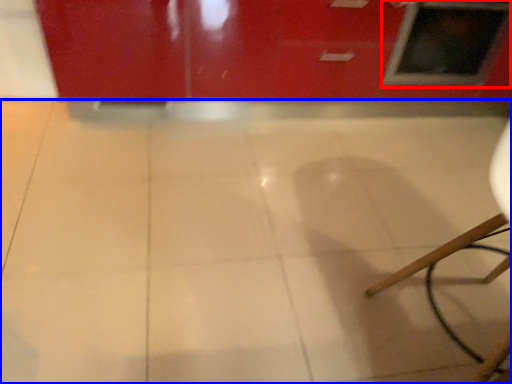
Question: Which object appears farthest to the camera in this image, window (highlighted by a red box) or ceramic tile (highlighted by a blue box)?

Choices:
 (A) window
 (B) ceramic tile

Answer: (A)